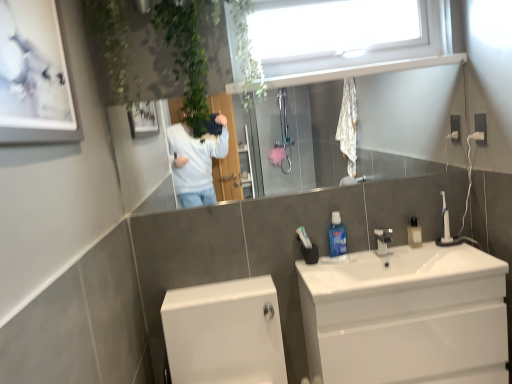
Question: Is white glossy picture frame at upper left wider than white glossy sink at center?

Choices:
 (A) yes
 (B) no

Answer: (B)

Question: From the image's perspective, is white glossy picture frame at upper left below white glossy sink at center?

Choices:
 (A) yes
 (B) no

Answer: (B)

Question: Does white glossy picture frame at upper left appear on the right side of white glossy sink at center?

Choices:
 (A) no
 (B) yes

Answer: (A)

Question: Could white glossy sink at center be considered to be inside white glossy picture frame at upper left?

Choices:
 (A) yes
 (B) no

Answer: (B)

Question: Does white glossy picture frame at upper left have a lesser height compared to white glossy sink at center?

Choices:
 (A) no
 (B) yes

Answer: (A)

Question: Looking at the image, does blue plastic mouthwash at center, positioned as the first mouthwash in left-to-right order, seem bigger or smaller compared to white glossy cabinet at lower right?

Choices:
 (A) big
 (B) small

Answer: (B)

Question: In the image, is blue plastic mouthwash at center, positioned as the first mouthwash in left-to-right order, on the left side or the right side of white glossy cabinet at lower right?

Choices:
 (A) left
 (B) right

Answer: (A)

Question: Considering the positions of blue plastic mouthwash at center, positioned as the 2th mouthwash in right-to-left order, and white glossy cabinet at lower right in the image, is blue plastic mouthwash at center, positioned as the 2th mouthwash in right-to-left order, wider or thinner than white glossy cabinet at lower right?

Choices:
 (A) wide
 (B) thin

Answer: (B)

Question: Is point pyautogui.click(x=330, y=249) positioned closer to the camera than point pyautogui.click(x=448, y=317)?

Choices:
 (A) farther
 (B) closer

Answer: (A)

Question: Is translucent plastic mouthwash at sink right, the 1th mouthwash positioned from the right, inside the boundaries of white glossy toilet at lower left, or outside?

Choices:
 (A) inside
 (B) outside

Answer: (B)

Question: In terms of width, does translucent plastic mouthwash at sink right, arranged as the 2th mouthwash when viewed from the left, look wider or thinner when compared to white glossy toilet at lower left?

Choices:
 (A) wide
 (B) thin

Answer: (B)

Question: Relative to white glossy toilet at lower left, is translucent plastic mouthwash at sink right, arranged as the 2th mouthwash when viewed from the left, in front or behind?

Choices:
 (A) front
 (B) behind

Answer: (B)

Question: Does point (417, 241) appear closer or farther from the camera than point (192, 355)?

Choices:
 (A) farther
 (B) closer

Answer: (A)

Question: Which is correct: glossy glass mirror at upper center is inside white glossy toilet at lower left, or outside of it?

Choices:
 (A) outside
 (B) inside

Answer: (A)

Question: From a real-world perspective, is glossy glass mirror at upper center above or below white glossy toilet at lower left?

Choices:
 (A) above
 (B) below

Answer: (A)